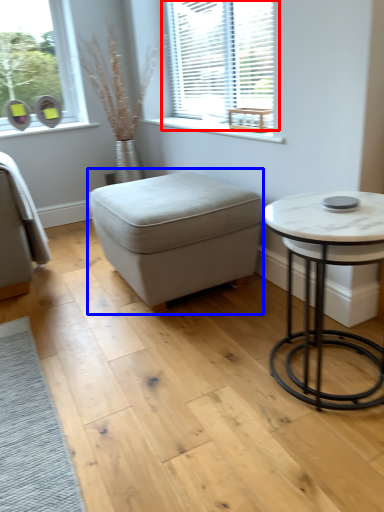
Question: Among these objects, which one is nearest to the camera, window (highlighted by a red box) or music stool (highlighted by a blue box)?

Choices:
 (A) window
 (B) music stool

Answer: (B)